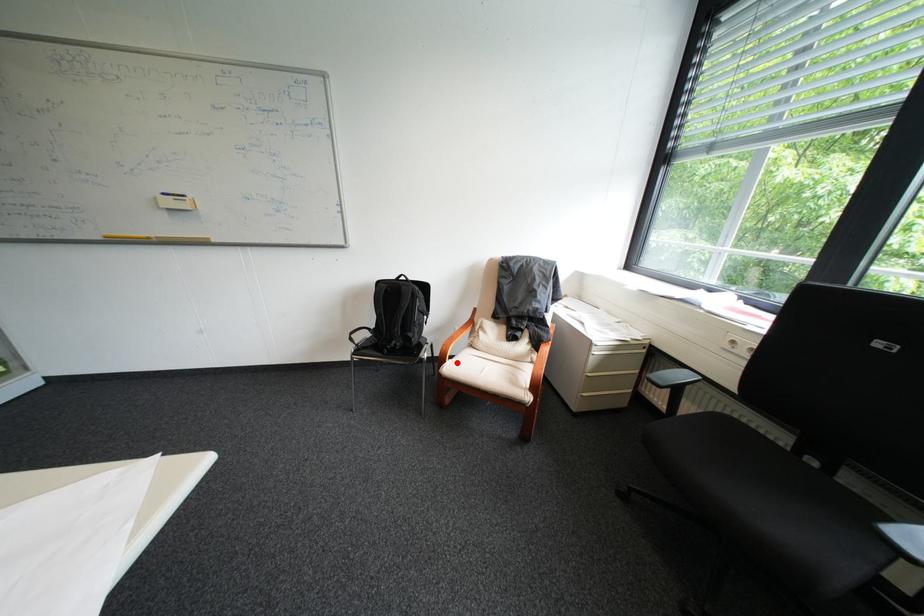
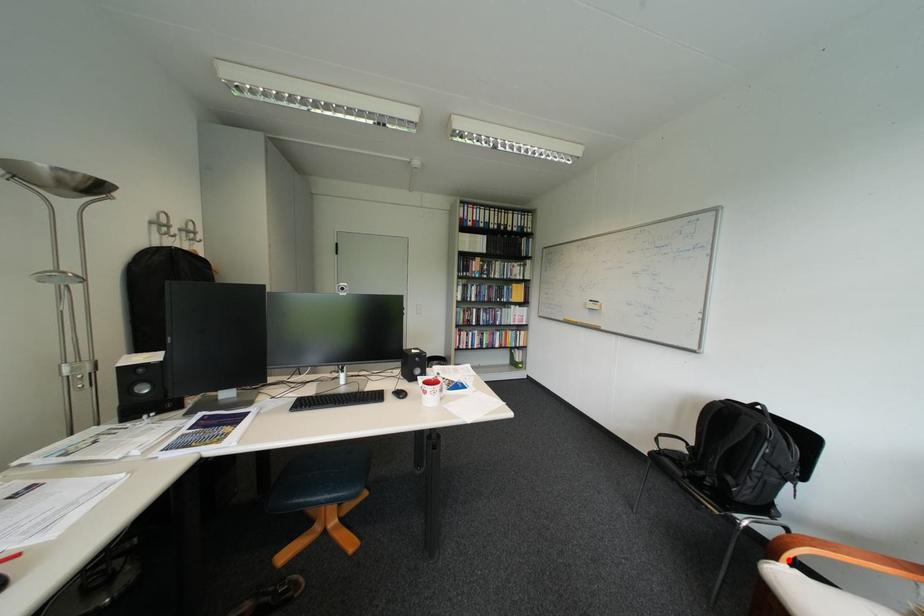
I am providing you with two images of the same scene from different viewpoints. A red point is marked on the first image and another point is marked on the second image. Is the red point in image1 aligned with the point shown in image2?

Yes